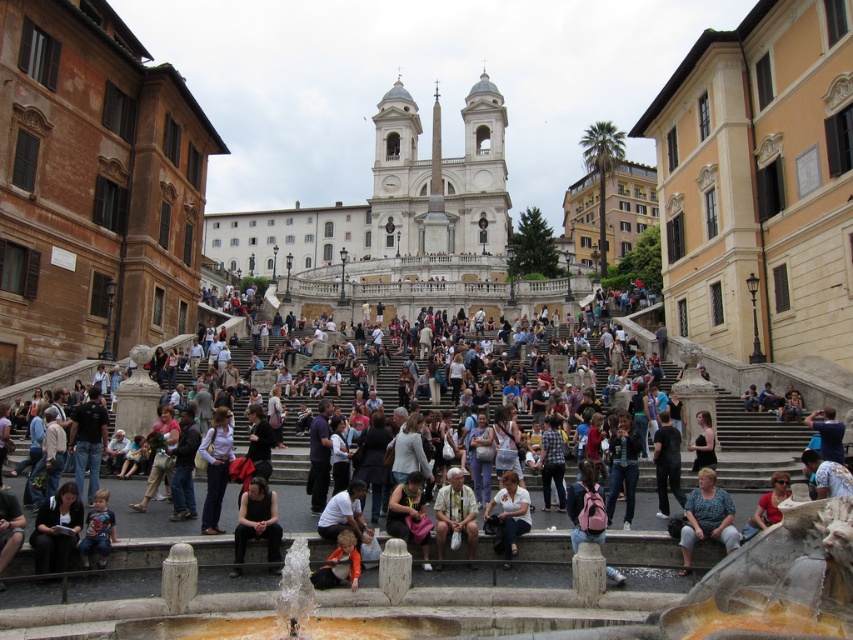
Is stone fountain at lower center thinner than matte blue shirt at lower left?

Incorrect, stone fountain at lower center's width is not less than matte blue shirt at lower left's.

Which of these two, stone fountain at lower center or matte blue shirt at lower left, stands taller?

stone fountain at lower center

Is point (97, 624) farther from camera compared to point (100, 488)?

No, it is in front of (100, 488).

What are the coordinates of `stone fountain at lower center` in the screenshot? It's located at (631, 593).

Which is in front, point (846, 634) or point (45, 509)?

Point (846, 634) is more forward.

Who is lower down, stone fountain at lower center or dark gray fabric jacket at lower left?

stone fountain at lower center is lower down.

Describe the element at coordinates (631, 593) in the screenshot. The height and width of the screenshot is (640, 853). I see `stone fountain at lower center` at that location.

You are a GUI agent. You are given a task and a screenshot of the screen. Output one action in this format:
    pyautogui.click(x=<x>, y=<y>)
    Task: Click on the stone fountain at lower center
    The image size is (853, 640).
    Given the screenshot: What is the action you would take?
    pyautogui.click(x=631, y=593)

Does light blue denim jeans at center have a greater width compared to matte red shirt at lower right?

Incorrect, light blue denim jeans at center's width does not surpass matte red shirt at lower right's.

What do you see at coordinates (215, 467) in the screenshot? Image resolution: width=853 pixels, height=640 pixels. I see `light blue denim jeans at center` at bounding box center [215, 467].

Where is `light blue denim jeans at center`? The width and height of the screenshot is (853, 640). light blue denim jeans at center is located at coordinates (215, 467).